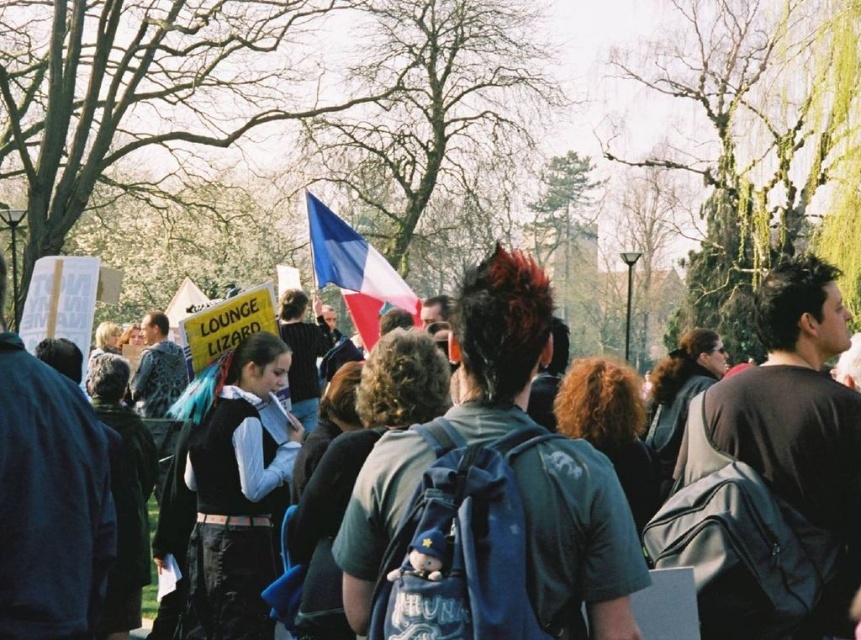
Can you confirm if dark gray backpack at center is shorter than blue fabric flag at center?

No.

Between point (581, 497) and point (313, 256), which one is positioned in front?

Point (581, 497) is in front.

Between point (523, 406) and point (387, 301), which one is positioned in front?

Point (523, 406)

Where is `dark gray backpack at center`? This screenshot has width=861, height=640. dark gray backpack at center is located at coordinates (500, 330).